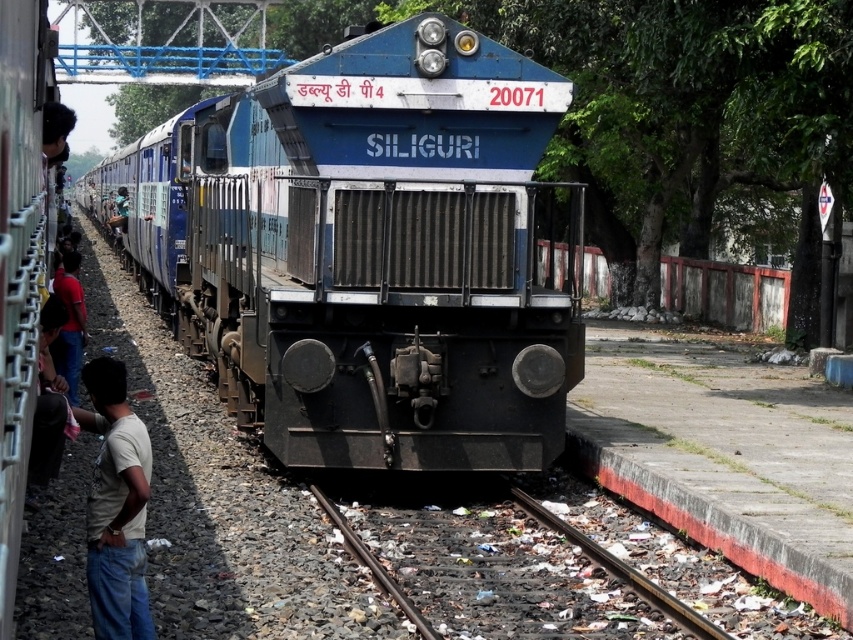
Does blue metallic train at center lie behind light beige t-shirt at lower left?

Yes, it is.

Based on the photo, who is shorter, blue metallic train at center or light beige t-shirt at lower left?

light beige t-shirt at lower left is shorter.

Describe the element at coordinates (369, 252) in the screenshot. I see `blue metallic train at center` at that location.

The width and height of the screenshot is (853, 640). I want to click on blue metallic train at center, so click(x=369, y=252).

Is point (601, 554) positioned behind point (32, 474)?

Yes, it is behind point (32, 474).

Does smooth metal train track at center have a smaller size compared to dark blue shirt at left?

Indeed, smooth metal train track at center has a smaller size compared to dark blue shirt at left.

Is point (363, 554) positioned after point (44, 388)?

No, (363, 554) is in front of (44, 388).

Locate an element on the screen. Image resolution: width=853 pixels, height=640 pixels. smooth metal train track at center is located at coordinates (622, 572).

Does light beige t-shirt at lower left have a greater height compared to dark blue jeans at left?

No.

Is point (112, 579) less distant than point (51, 346)?

Yes, it is in front of point (51, 346).

Is point (120, 460) farther from viewer compared to point (76, 337)?

No.

Locate an element on the screen. The width and height of the screenshot is (853, 640). light beige t-shirt at lower left is located at coordinates (115, 506).